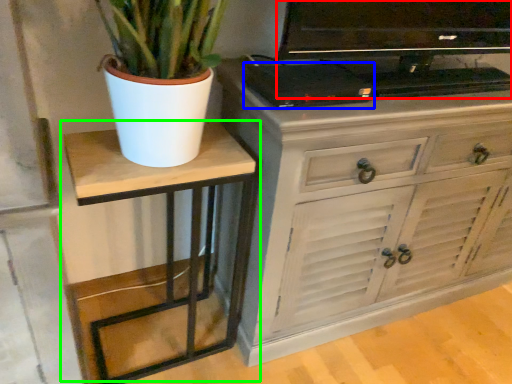
Question: Which object is positioned farthest from television (highlighted by a red box)? Select from appliance (highlighted by a blue box) and table (highlighted by a green box).

Choices:
 (A) appliance
 (B) table

Answer: (B)